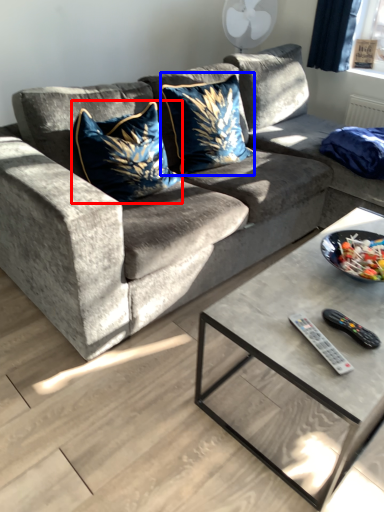
Question: Which of the following is the farthest to the observer, throw pillow (highlighted by a red box) or throw pillow (highlighted by a blue box)?

Choices:
 (A) throw pillow
 (B) throw pillow

Answer: (B)